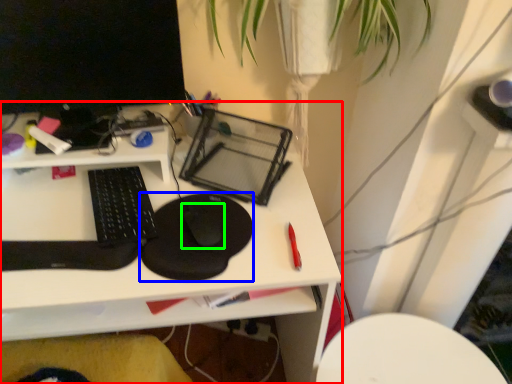
Question: Which is farther away from desk (highlighted by a red box)? mousepad (highlighted by a blue box) or mouse (highlighted by a green box)?

Choices:
 (A) mousepad
 (B) mouse

Answer: (B)